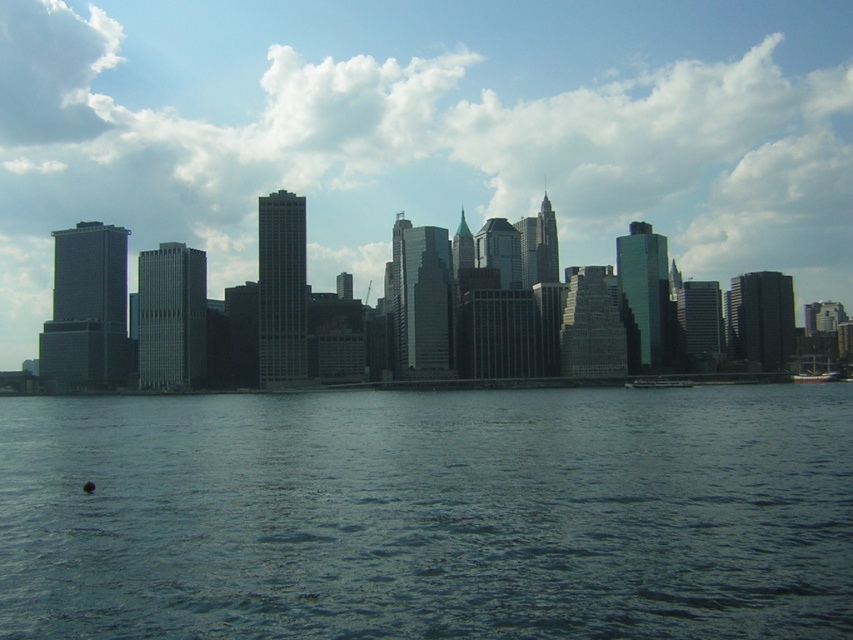
You are standing on a pier and want to reach the white matte boat at lower right without getting your feet wet. Can you walk directly to it from your current position on the pier, considering the dark blue water at lower center is in front of the boat?

The dark blue water at lower center is in front of the white matte boat at lower right, so you cannot walk directly to the boat without crossing the water.